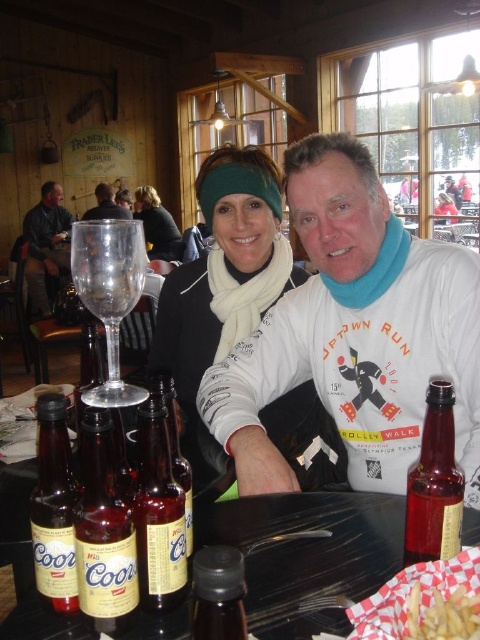
You are taking a photo of the two people at the table. The matte white scarf at center and the matte black jacket at upper center are both in the frame. Which object is positioned to the right side of the other?

The matte white scarf at center is to the right of the matte black jacket at upper center.

You are standing at the entrance of the restaurant and want to take a photo of the amber glass beer bottle at center. Where should you position yourself to ensure the bottle is in the frame?

Position yourself so that your camera is aimed at the coordinates corresponding to point 0.803 on the horizontal axis and 0.331 on the vertical axis to capture the amber glass beer bottle at center in the frame.